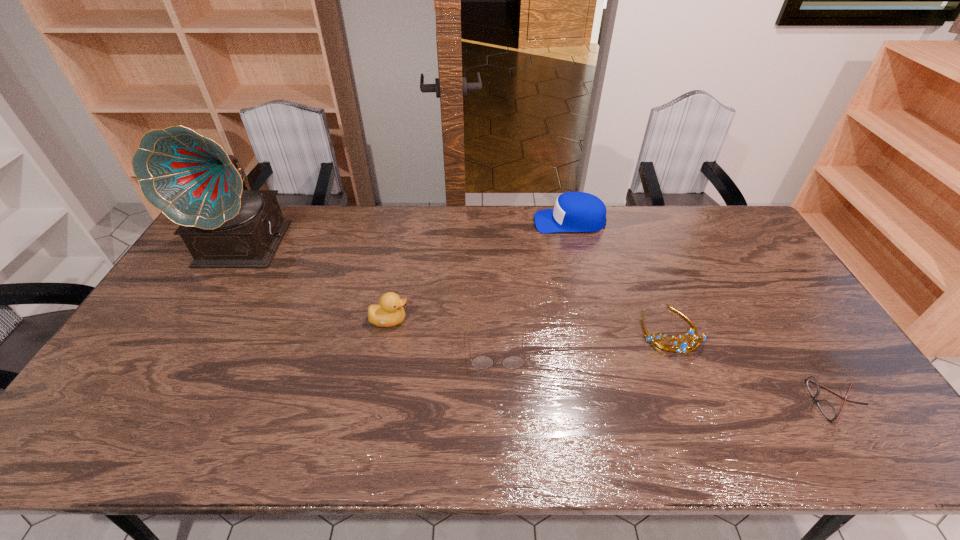
I want to click on the second closest object relative to the shortest object, so click(x=480, y=362).

Where is `free location that satisfies the following two spatial constraints: 1. on the front-facing side of the baseball cap; 2. on the horn of the tallest object`? free location that satisfies the following two spatial constraints: 1. on the front-facing side of the baseball cap; 2. on the horn of the tallest object is located at coordinates (576, 246).

Find the location of a particular element. The width and height of the screenshot is (960, 540). free space that satisfies the following two spatial constraints: 1. on the front-facing side of the baseball cap; 2. on the temples of the third object from left to right is located at coordinates point(601,349).

Locate an element on the screen. The height and width of the screenshot is (540, 960). free space in the image that satisfies the following two spatial constraints: 1. on the front-facing side of the baseball cap; 2. on the horn of the record player is located at coordinates (576, 246).